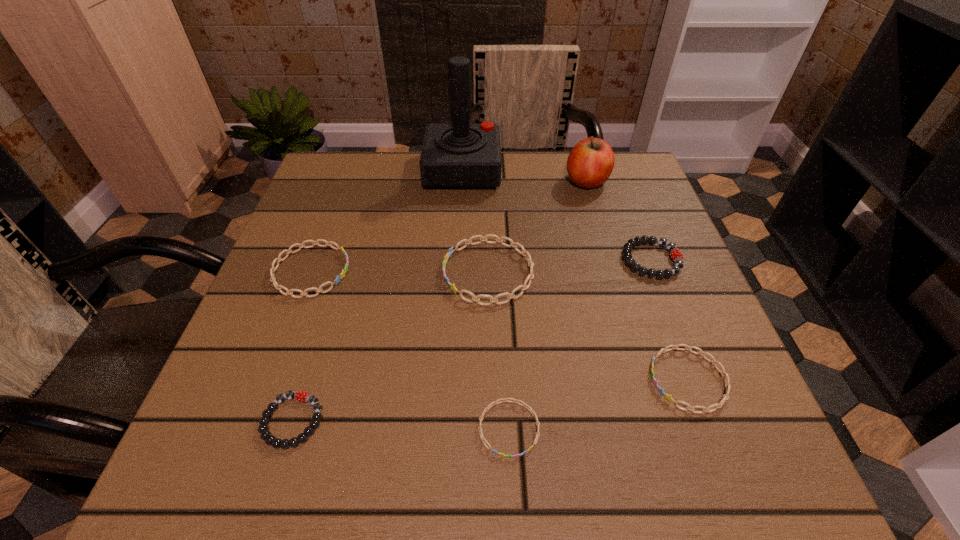
Find the location of `the tallest object`. the tallest object is located at coordinates (x=460, y=155).

At what (x,y) coordinates should I click in order to perform the action: click on joystick. Please return your answer as a coordinate pair (x, y). This screenshot has height=540, width=960. Looking at the image, I should click on (460, 155).

Where is `apple`? The image size is (960, 540). apple is located at coordinates (591, 161).

The height and width of the screenshot is (540, 960). Identify the location of the biggest blue bracelet. (523, 287).

Locate an element on the screen. This screenshot has width=960, height=540. the third tallest object is located at coordinates (523, 287).

At what (x,y) coordinates should I click in order to perform the action: click on the third smallest blue bracelet. Please return your answer as a coordinate pair (x, y). This screenshot has height=540, width=960. Looking at the image, I should click on (278, 260).

Where is `the bigger black bracelet`? the bigger black bracelet is located at coordinates (676, 255).

You are a GUI agent. You are given a task and a screenshot of the screen. Output one action in this format:
    pyautogui.click(x=<x>, y=<y>)
    Task: Click on the farther black bracelet
    
    Given the screenshot: What is the action you would take?
    pyautogui.click(x=676, y=255)

This screenshot has height=540, width=960. Identify the location of the second smallest blue bracelet. [x=727, y=384].

The height and width of the screenshot is (540, 960). What are the coordinates of `the nearer black bracelet` in the screenshot? It's located at click(x=265, y=435).